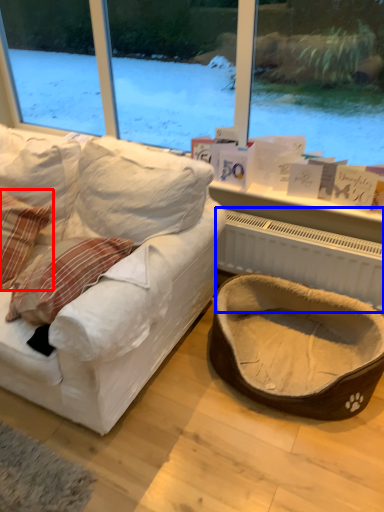
Question: Which of the following is the farthest to the observer, pillow (highlighted by a red box) or radiator (highlighted by a blue box)?

Choices:
 (A) pillow
 (B) radiator

Answer: (B)